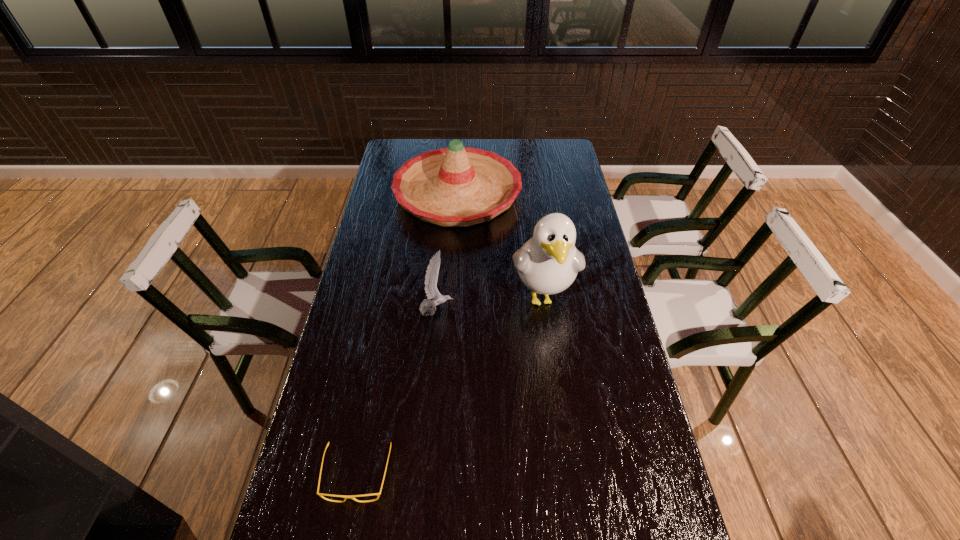
Where is `vacant space located 0.280m at the tip of the beak of the shorter gull`? vacant space located 0.280m at the tip of the beak of the shorter gull is located at coordinates (542, 310).

Where is `vacant space located 0.050m in front of the lenses of the shortest object`? Image resolution: width=960 pixels, height=540 pixels. vacant space located 0.050m in front of the lenses of the shortest object is located at coordinates (347, 529).

I want to click on object that is at the far edge, so click(457, 186).

You are a GUI agent. You are given a task and a screenshot of the screen. Output one action in this format:
    pyautogui.click(x=<x>, y=<y>)
    Task: Click on the sombrero at the left edge
    The width and height of the screenshot is (960, 540).
    Given the screenshot: What is the action you would take?
    pyautogui.click(x=457, y=186)

Identify the location of spectacles at the left edge. (320, 494).

The height and width of the screenshot is (540, 960). In order to click on object that is at the right edge in this screenshot , I will do (x=548, y=263).

Identify the location of object located in the far left corner section of the desktop. (457, 186).

In the image, there is a desktop. At what (x,y) coordinates should I click in order to perform the action: click on free space at the left edge. Please return your answer as a coordinate pair (x, y). This screenshot has width=960, height=540. Looking at the image, I should click on (326, 396).

This screenshot has height=540, width=960. Identify the location of blank space at the right edge. (581, 274).

In the image, there is a desktop. At what (x,y) coordinates should I click in order to perform the action: click on blank space at the far right corner. Please return your answer as a coordinate pair (x, y). This screenshot has height=540, width=960. Looking at the image, I should click on (556, 145).